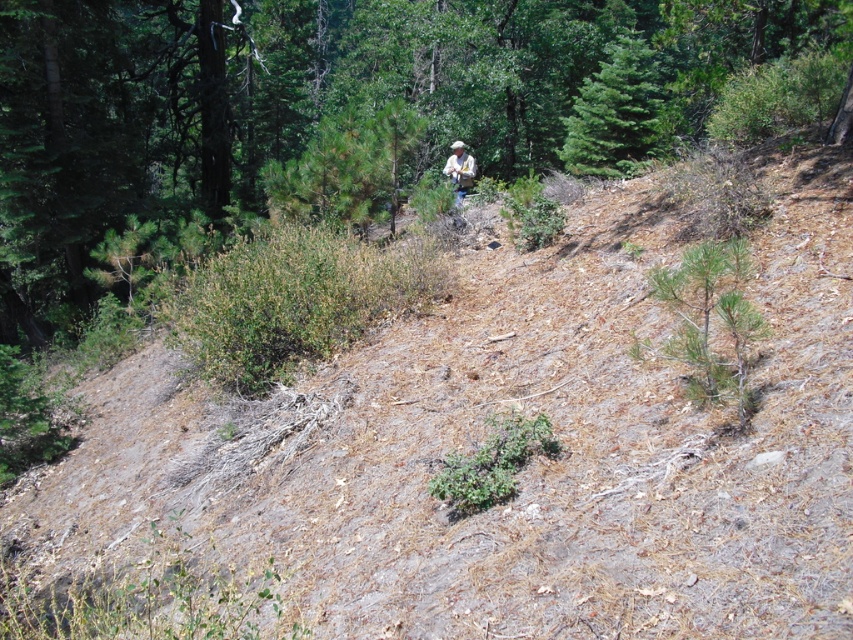
Question: Among these objects, which one is nearest to the camera?

Choices:
 (A) green fir tree at upper center
 (B) tan fabric shirt at center

Answer: (A)

Question: Among these points, which one is farthest from the camera?

Choices:
 (A) (642, 42)
 (B) (457, 172)

Answer: (B)

Question: Is green fir tree at upper center further to camera compared to tan fabric shirt at center?

Choices:
 (A) yes
 (B) no

Answer: (B)

Question: Is green fir tree at upper center wider than tan fabric shirt at center?

Choices:
 (A) yes
 (B) no

Answer: (B)

Question: Which point is closer to the camera taking this photo?

Choices:
 (A) (624, 49)
 (B) (462, 172)

Answer: (A)

Question: Can you confirm if green fir tree at upper center is smaller than tan fabric shirt at center?

Choices:
 (A) no
 (B) yes

Answer: (B)